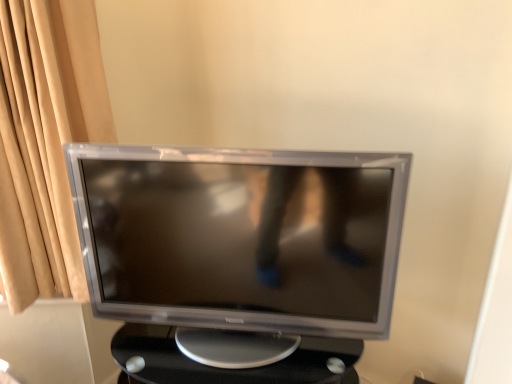
The height and width of the screenshot is (384, 512). I want to click on free space below satin silver monitor at center (from a real-world perspective), so click(x=245, y=340).